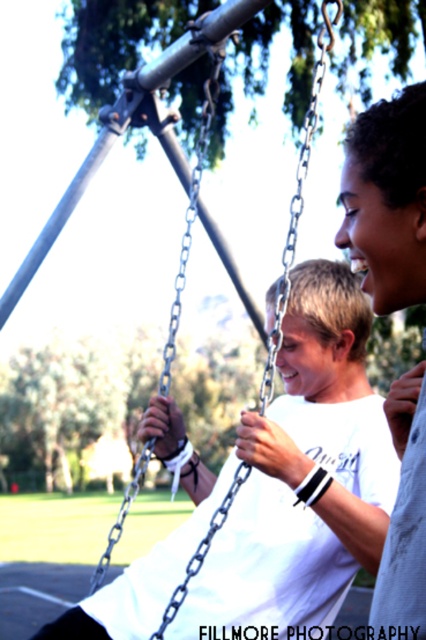
From the picture: You are standing at the camera position and want to reach the point marked as point (268, 602). If your maximum reach is 2.5 meters, can you touch it without moving your feet?

The point (268, 602) is 2.86 meters away from the camera, which exceeds your maximum reach of 2.5 meters. Therefore, you cannot touch it without moving your feet.

You are standing near the swing set and see the white cotton shirt at center and the metallic chain swing at center. Which object is positioned higher in the image?

The white cotton shirt at center is above the metallic chain swing at center, so it is positioned higher in the image.